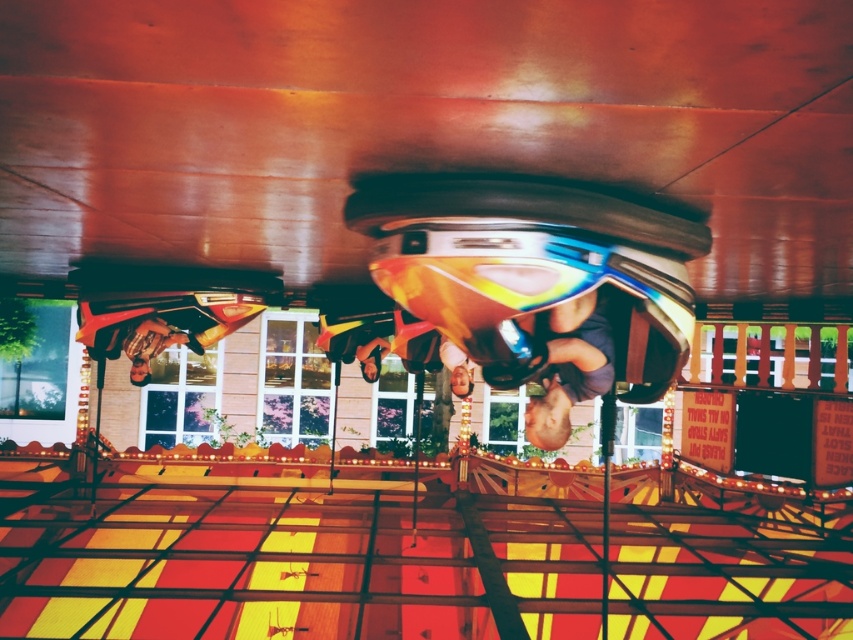
In the scene shown: Is matte blue helmet at center to the left of metallic gold helmet at left from the viewer's perspective?

Incorrect, matte blue helmet at center is not on the left side of metallic gold helmet at left.

At what (x,y) coordinates should I click in order to perform the action: click on matte blue helmet at center. Please return your answer as a coordinate pair (x, y). Image resolution: width=853 pixels, height=640 pixels. Looking at the image, I should click on (563, 369).